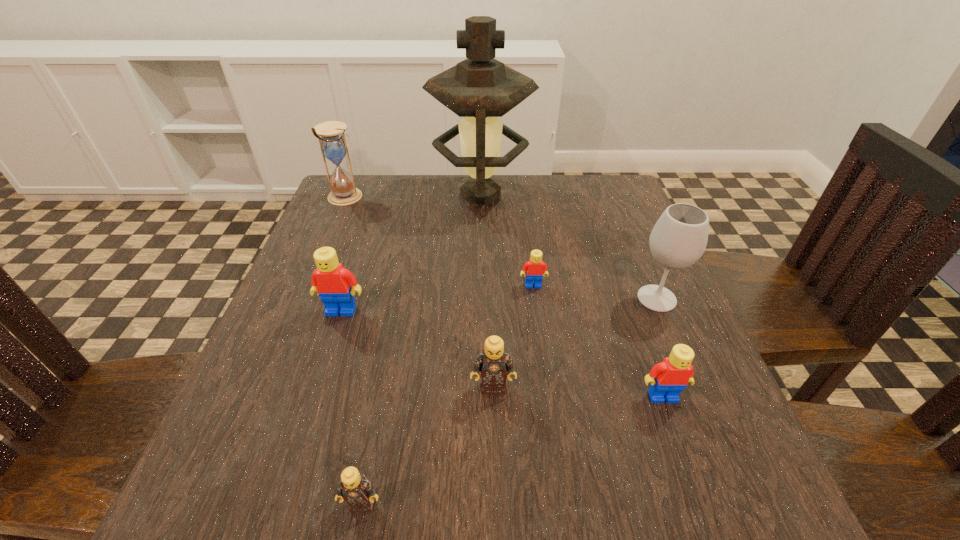
The height and width of the screenshot is (540, 960). What are the coordinates of `oil lamp at the far edge` in the screenshot? It's located at (480, 89).

I want to click on hourglass positioned at the far edge, so click(x=333, y=145).

At what (x,y) coordinates should I click in order to perform the action: click on object that is positioned at the near edge. Please return your answer as a coordinate pair (x, y). The width and height of the screenshot is (960, 540). Looking at the image, I should click on (355, 489).

Find the location of a particular element. This screenshot has height=540, width=960. hourglass at the left edge is located at coordinates (333, 145).

Find the location of a particular element. Lego located in the left edge section of the desktop is located at coordinates (333, 282).

Locate an element on the screen. wineglass that is at the right edge is located at coordinates (679, 238).

What are the coordinates of `Lego that is at the right edge` in the screenshot? It's located at (668, 378).

The height and width of the screenshot is (540, 960). I want to click on object at the far left corner, so click(x=333, y=145).

In the image, there is a desktop. Find the location of `vacant region at the far edge`. vacant region at the far edge is located at coordinates (497, 173).

At what (x,y) coordinates should I click in order to perform the action: click on free region at the near edge of the desktop. Please return your answer as a coordinate pair (x, y). The height and width of the screenshot is (540, 960). Looking at the image, I should click on (541, 490).